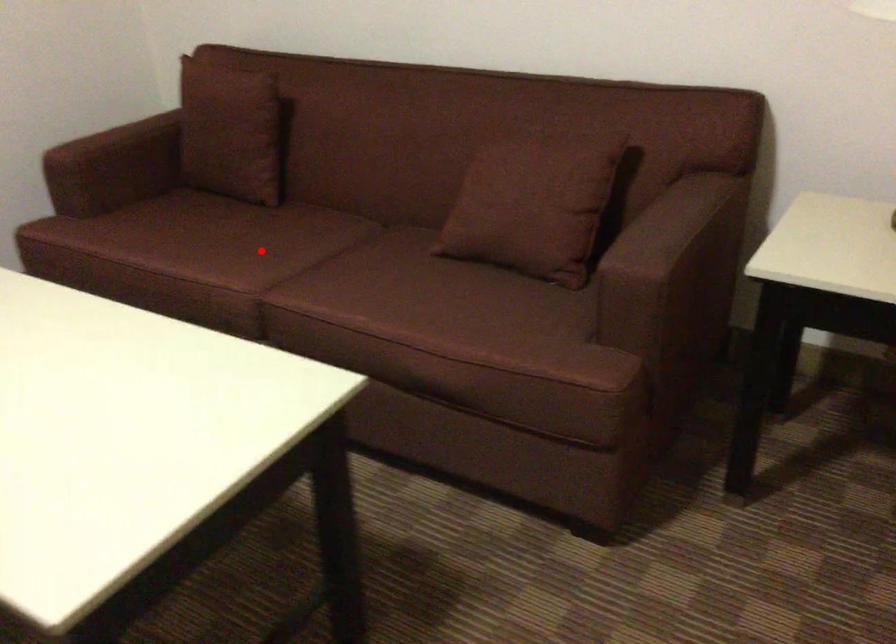
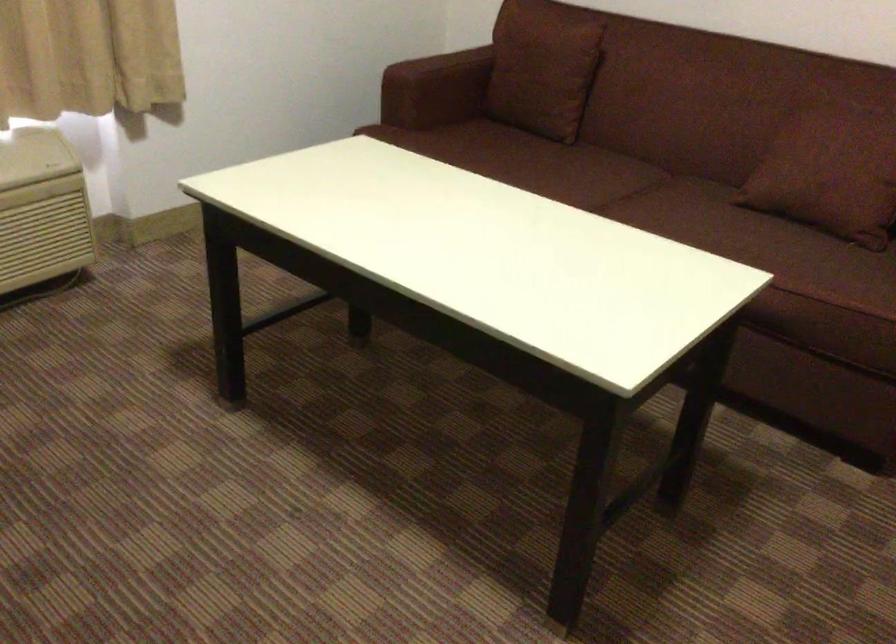
Question: A red point is marked in image1. In image2, is the corresponding 3D point closer to the camera or farther? Reply with the corresponding letter.

Choices:
 (A) The corresponding 3D point is closer.
 (B) The corresponding 3D point is farther.

Answer: (B)